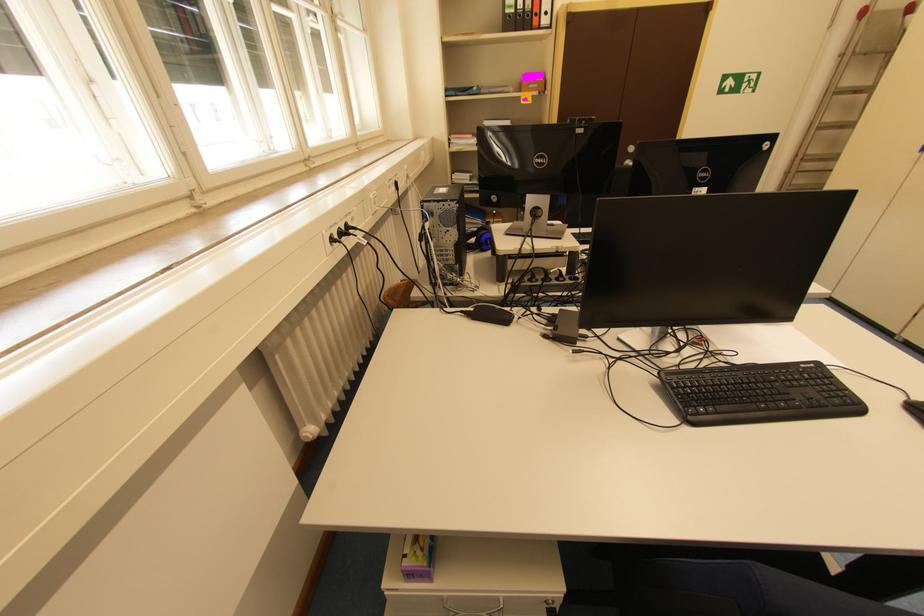
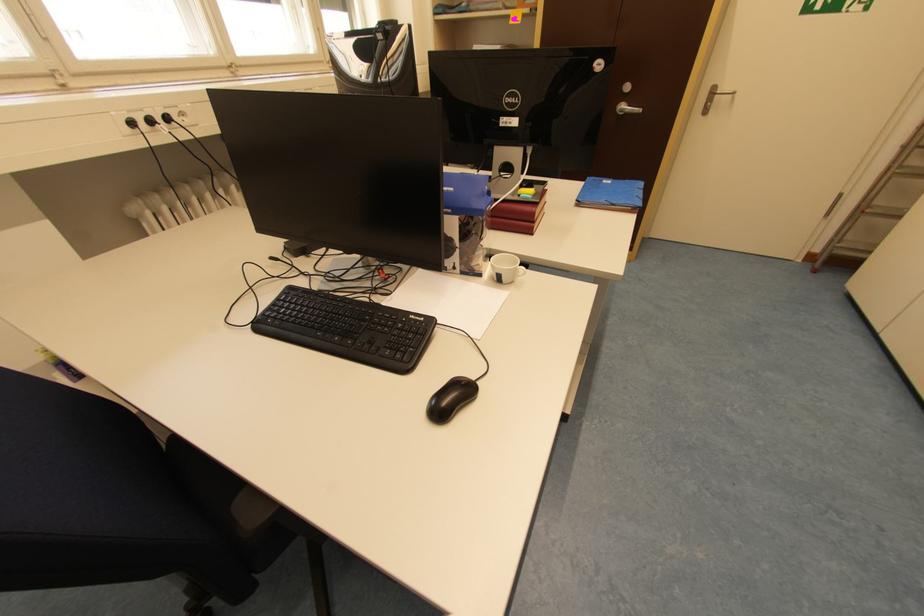
Question: The images are taken continuously from a first-person perspective. In which direction are you moving?

Choices:
 (A) Left
 (B) Right
 (C) Forward
 (D) Backward

Answer: (B)